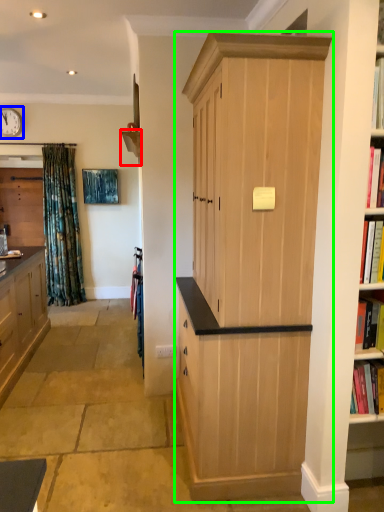
Question: Estimate the real-world distances between objects in this image. Which object is farther from shelf (highlighted by a red box), clock (highlighted by a blue box) or cabinetry (highlighted by a green box)?

Choices:
 (A) clock
 (B) cabinetry

Answer: (A)